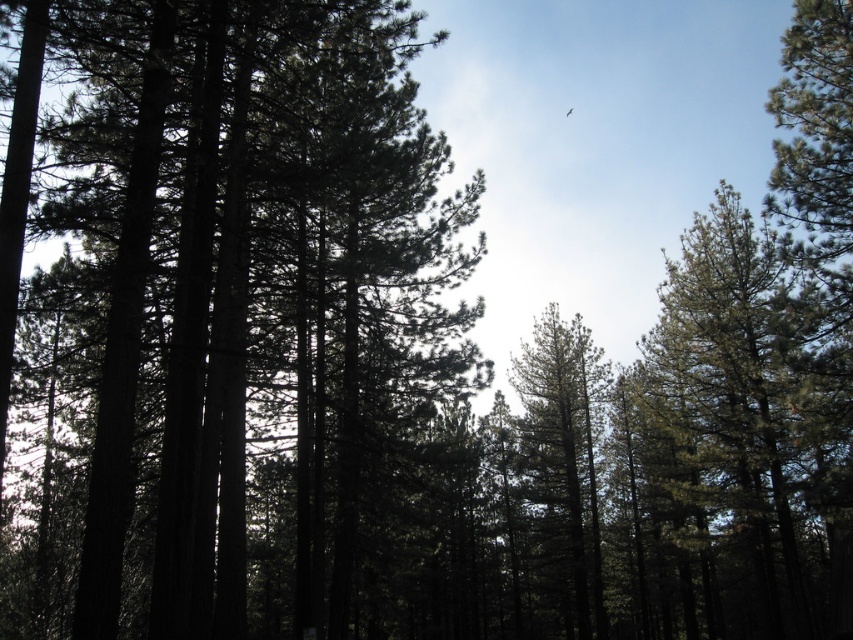
Question: From the image, what is the correct spatial relationship of dark green pine trees at center in relation to green matte tree at center?

Choices:
 (A) right
 (B) left

Answer: (B)

Question: Is dark green pine trees at center to the right of green matte tree at center from the viewer's perspective?

Choices:
 (A) yes
 (B) no

Answer: (B)

Question: Observing the image, what is the correct spatial positioning of dark green pine trees at center in reference to green matte tree at center?

Choices:
 (A) left
 (B) right

Answer: (A)

Question: Which point is closer to the camera?

Choices:
 (A) (550, 525)
 (B) (102, 369)

Answer: (B)

Question: Which of the following is the closest to the observer?

Choices:
 (A) dark green pine trees at center
 (B) green matte tree at center

Answer: (A)